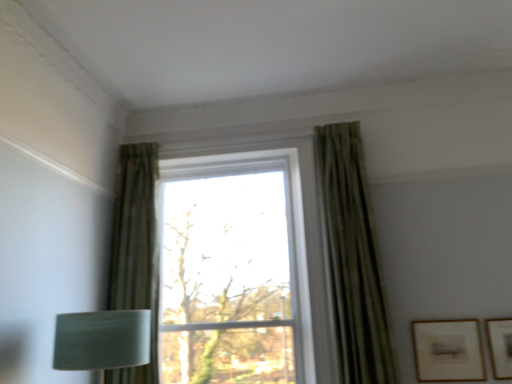
Question: Based on their sizes in the image, would you say transparent glass window at center is bigger or smaller than matte gold picture frame at lower right, positioned as the 2th picture frame in left-to-right order?

Choices:
 (A) small
 (B) big

Answer: (B)

Question: Considering the positions of transparent glass window at center and matte gold picture frame at lower right, positioned as the 2th picture frame in left-to-right order, in the image, is transparent glass window at center taller or shorter than matte gold picture frame at lower right, positioned as the 2th picture frame in left-to-right order,?

Choices:
 (A) tall
 (B) short

Answer: (A)

Question: Which object is positioned closest to the green textured curtain at left, marked as the 1th curtain in a left-to-right arrangement?

Choices:
 (A) matte gold picture frame at lower right, the first picture frame positioned from the left
 (B) matte gold picture frame at lower right, arranged as the 1th picture frame when viewed from the right
 (C) green textured curtain at upper right, the 2th curtain from the left
 (D) transparent glass window at center

Answer: (D)

Question: Which of these objects is positioned farthest from the green textured curtain at left, acting as the second curtain starting from the right?

Choices:
 (A) matte gold picture frame at lower right, the second picture frame viewed from the right
 (B) green textured curtain at upper right, the 2th curtain from the left
 (C) matte gold picture frame at lower right, positioned as the 2th picture frame in left-to-right order
 (D) transparent glass window at center

Answer: (C)